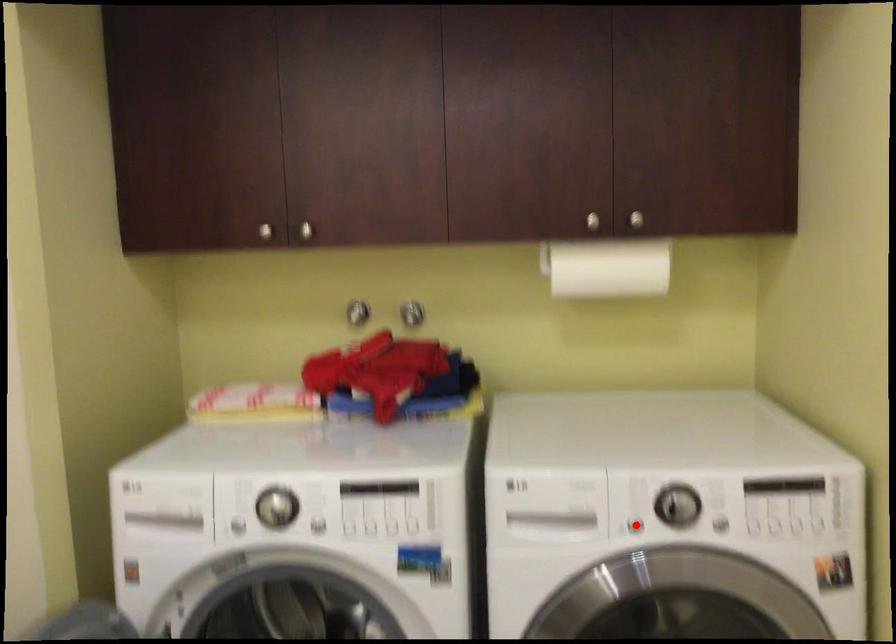
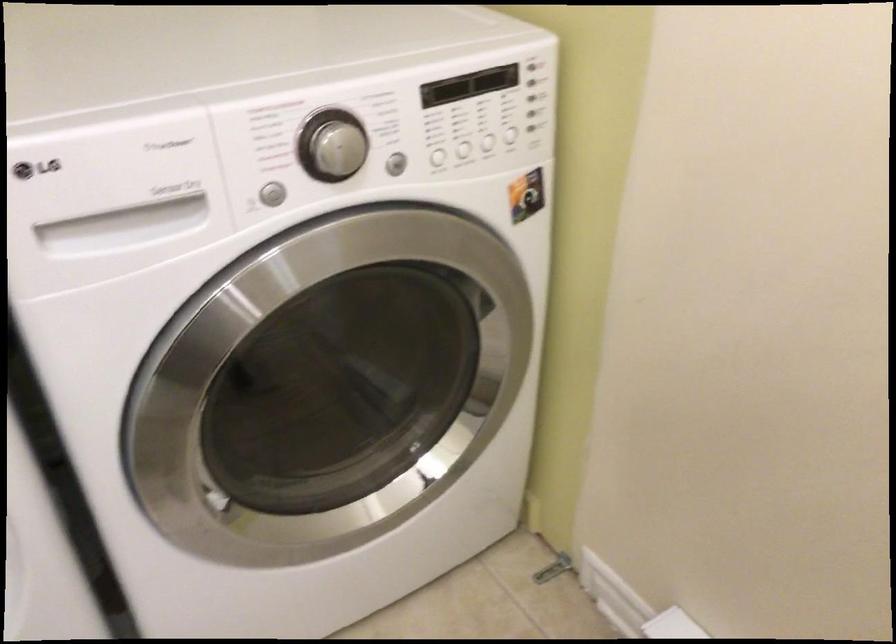
Question: I am providing you with two images of the same scene from different viewpoints. A red point is shown in image1. For the corresponding object point in image2, is it positioned nearer or farther from the camera?

Choices:
 (A) Nearer
 (B) Farther

Answer: (A)